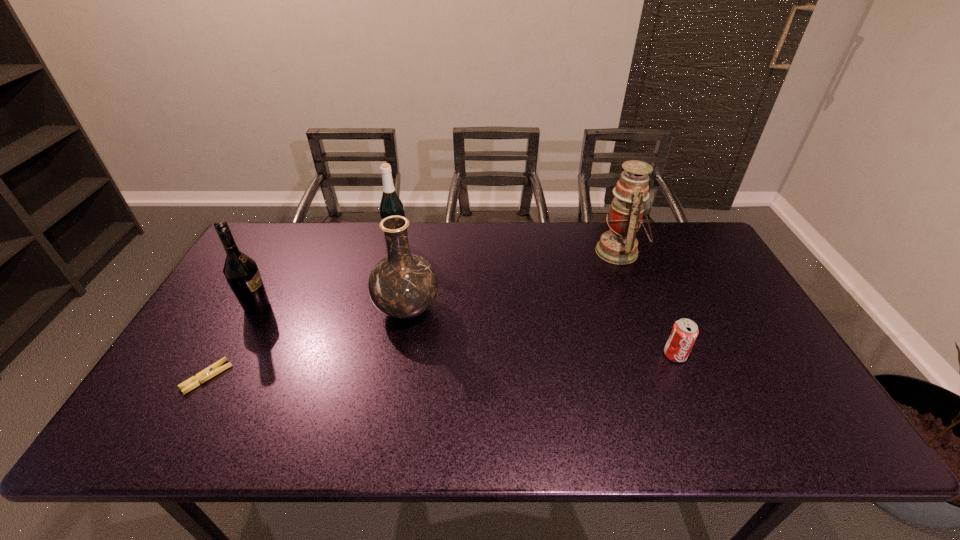
Where is `oil lamp`? oil lamp is located at coordinates (619, 245).

Locate an element on the screen. the right wine bottle is located at coordinates (x=390, y=205).

The image size is (960, 540). Identify the location of vase. pos(403,285).

Locate an element on the screen. This screenshot has height=540, width=960. the nearer wine bottle is located at coordinates (241, 272).

The height and width of the screenshot is (540, 960). I want to click on soda can, so click(x=685, y=331).

I want to click on clothespin, so click(214, 369).

Find the location of `vacant area situated 0.280m on the front of the oil lamp`. vacant area situated 0.280m on the front of the oil lamp is located at coordinates (653, 340).

In order to click on free space located on the label of the right wine bottle in this screenshot , I will do `click(373, 348)`.

Where is `free region located on the back of the vase`? free region located on the back of the vase is located at coordinates (415, 264).

At what (x,y) coordinates should I click in order to perform the action: click on vacant space located 0.260m on the label of the left wine bottle. Please return your answer as a coordinate pair (x, y). This screenshot has height=540, width=960. Looking at the image, I should click on (362, 307).